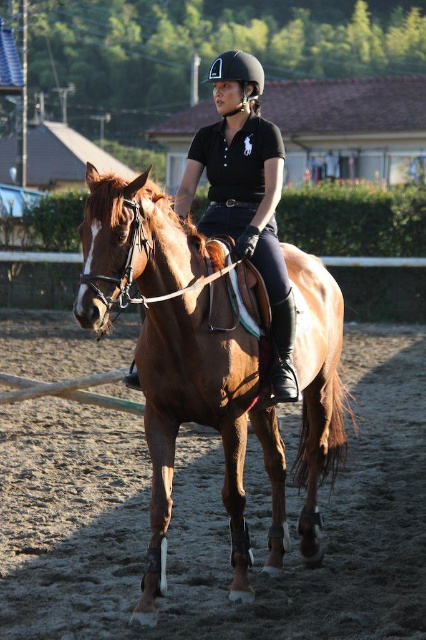
Does brown glossy horse at center have a lesser width compared to black matte helmet at center?

Incorrect, brown glossy horse at center's width is not less than black matte helmet at center's.

Does brown glossy horse at center lie in front of black matte helmet at center?

Yes, brown glossy horse at center is closer to the viewer.

Is point (215, 257) positioned in front of point (241, 52)?

Yes, it is.

Find the location of `brown glossy horse at center`. brown glossy horse at center is located at coordinates (207, 420).